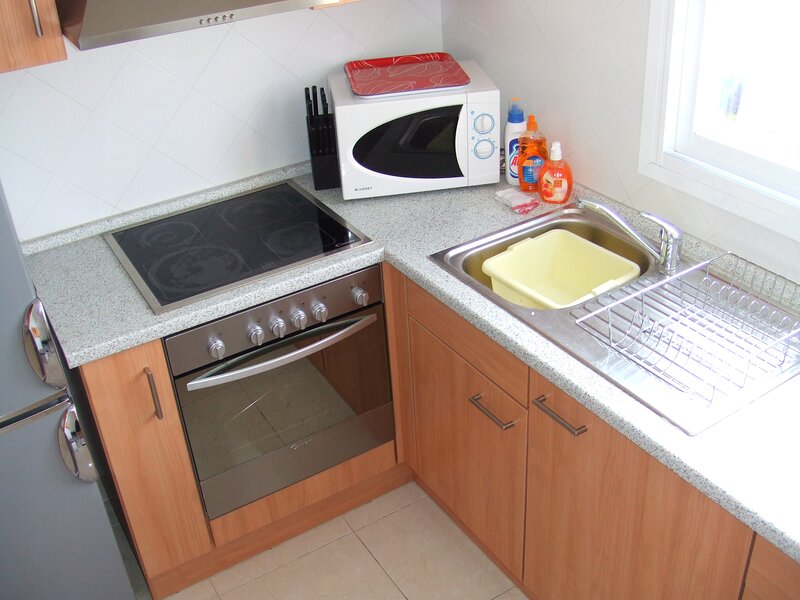
You are a GUI agent. You are given a task and a screenshot of the screen. Output one action in this format:
    pyautogui.click(x=<x>, y=<y>)
    Task: Click on the oven knob 1
    Image resolution: width=800 pixels, height=600 pixels.
    Given the screenshot: What is the action you would take?
    pyautogui.click(x=214, y=352)